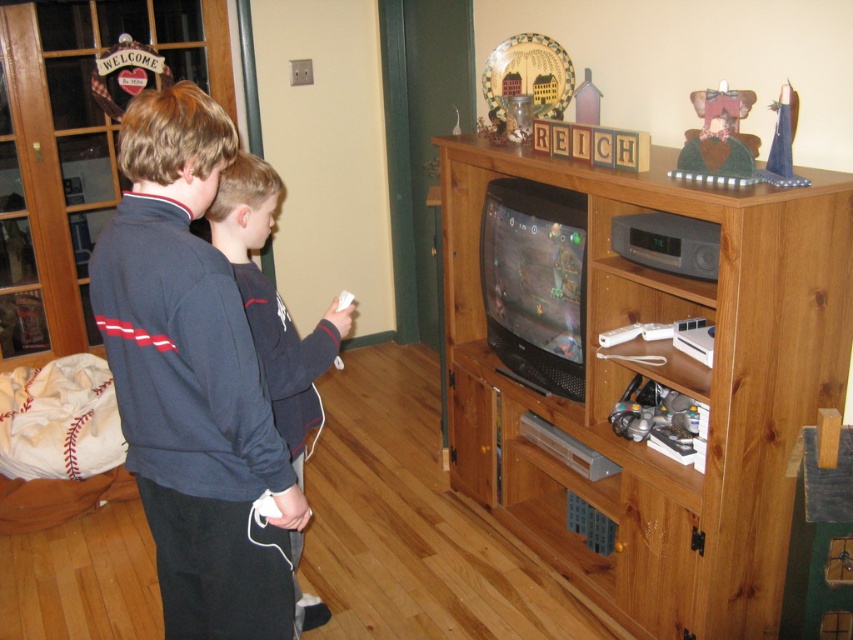
Question: Among these objects, which one is nearest to the camera?

Choices:
 (A) dark blue sweatshirt at left
 (B) white matte remote at center
 (C) brown wood entertainment center at center
 (D) dark blue sweatshirt at center

Answer: (A)

Question: Does dark blue sweatshirt at left lie behind white matte remote at center?

Choices:
 (A) no
 (B) yes

Answer: (A)

Question: Which point is farther to the camera?

Choices:
 (A) brown wood entertainment center at center
 (B) white matte remote at center
 (C) dark blue sweatshirt at left

Answer: (B)

Question: Which of these objects is positioned closest to the dark blue sweatshirt at center?

Choices:
 (A) white matte remote at center
 (B) brown wood entertainment center at center

Answer: (A)

Question: From the image, what is the correct spatial relationship of dark blue sweatshirt at center in relation to white matte remote at center?

Choices:
 (A) left
 (B) right

Answer: (A)

Question: Can you confirm if dark blue sweatshirt at left is positioned to the right of white matte remote at center?

Choices:
 (A) no
 (B) yes

Answer: (A)